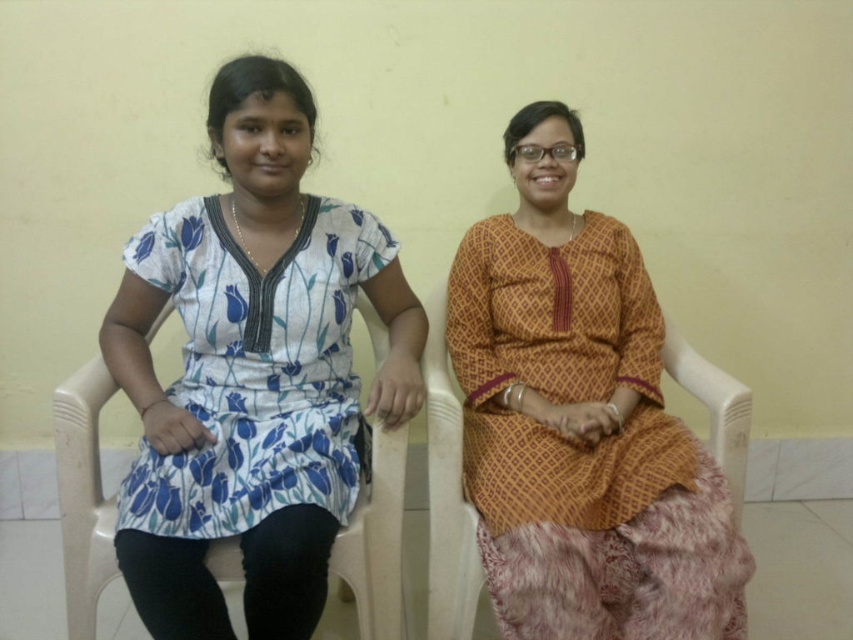
You are standing in front of the two people in the image. Which dress, the white floral dress at left or the matte orange dress at center, is positioned closer to you?

The white floral dress at left is closer to the viewer than the matte orange dress at center.

You are an artist trying to sketch the scene described. You need to place the white floral dress at left in your drawing. What are the coordinates where you should position it?

The white floral dress at left should be positioned at coordinates 0.581 on the x axis and 0.298 on the y axis.